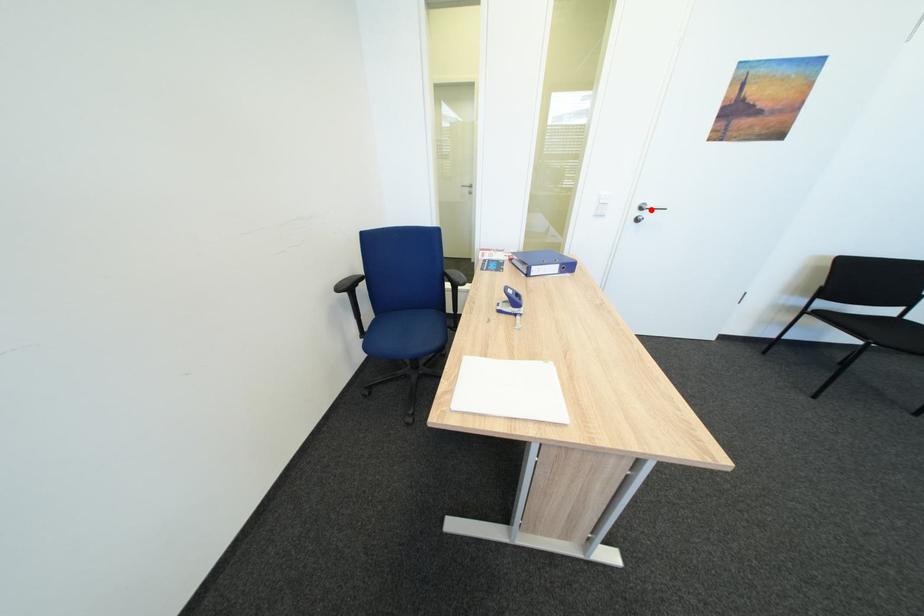
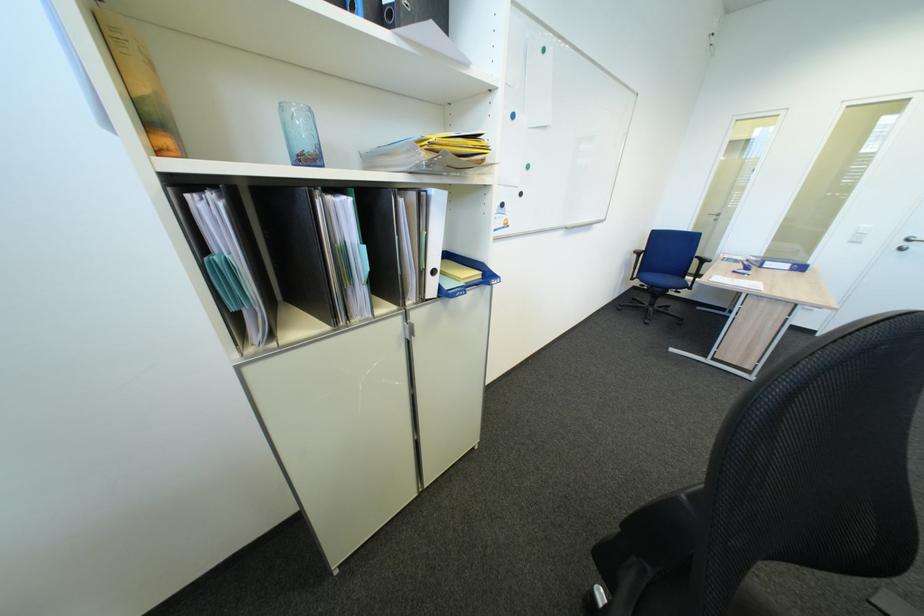
Question: I am providing you with two images of the same scene from different viewpoints. A red point is marked on the first image. Can you still see the location of the red point in image 2?

Choices:
 (A) Yes
 (B) No

Answer: (A)